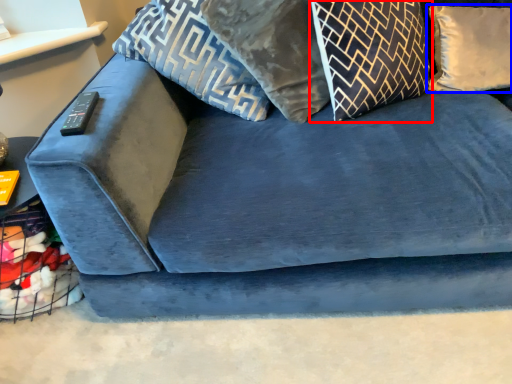
Question: Among these objects, which one is farthest to the camera, pillow (highlighted by a red box) or pillow (highlighted by a blue box)?

Choices:
 (A) pillow
 (B) pillow

Answer: (B)